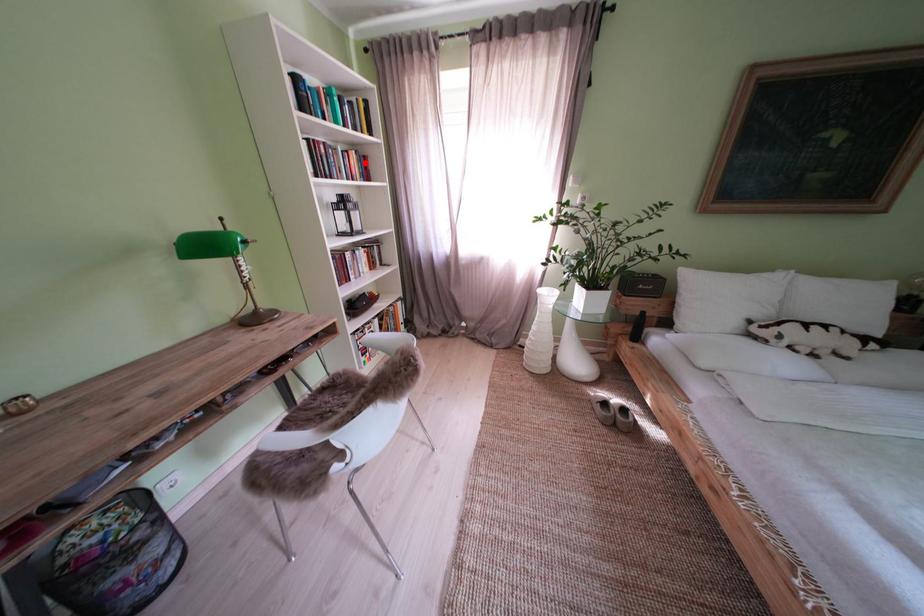
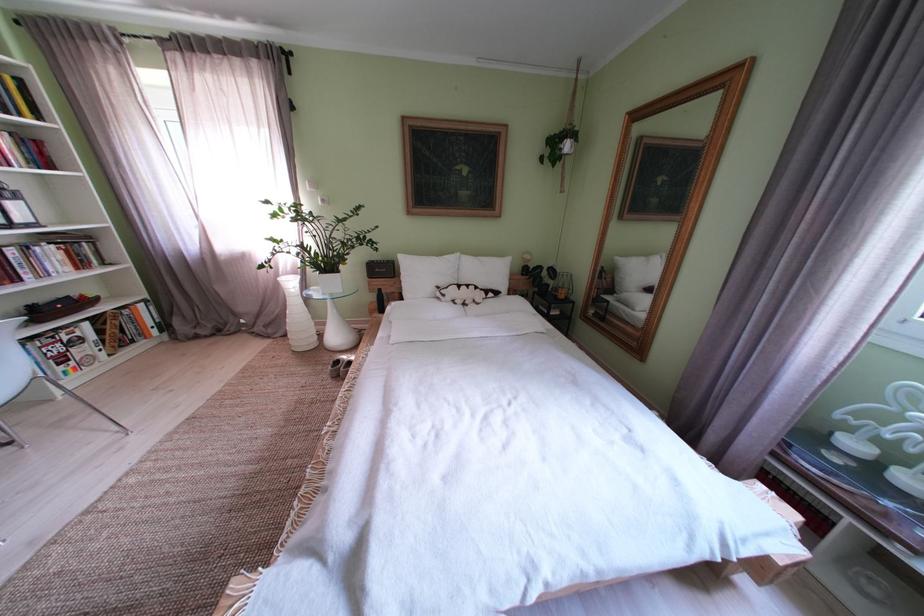
Question: I am providing you with two images of the same scene from different viewpoints. Given a red point in image1, look at the same physical point in image2. Is it:

Choices:
 (A) Closer to the viewpoint
 (B) Farther from the viewpoint

Answer: (B)